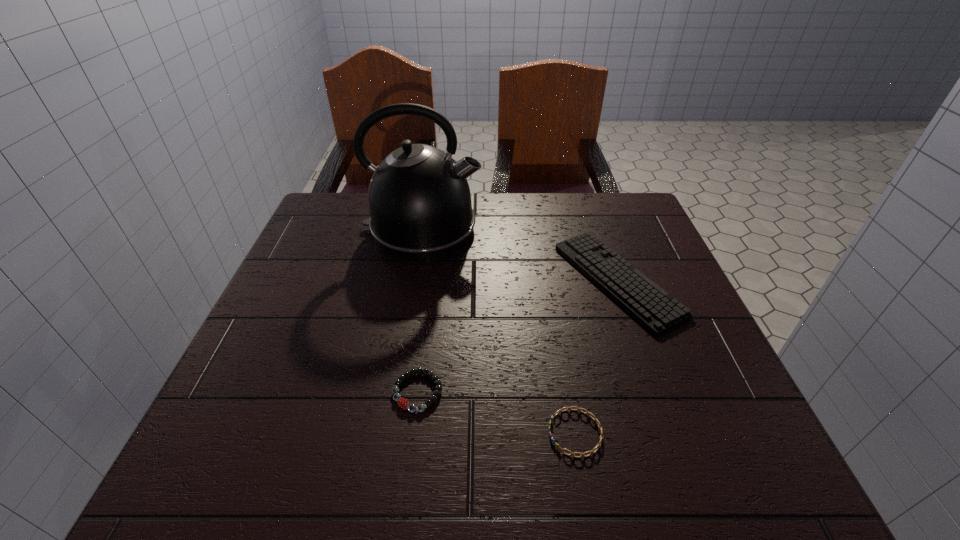
Locate an element on the screen. free space located 0.140m on the surface of the shorter bracelet showing star-shaped elements is located at coordinates (464, 433).

Where is `free point located 0.100m on the surface of the shorter bracelet showing star-shaped elements`? The width and height of the screenshot is (960, 540). free point located 0.100m on the surface of the shorter bracelet showing star-shaped elements is located at coordinates [x=488, y=433].

Locate an element on the screen. kettle at the far edge is located at coordinates (419, 199).

Image resolution: width=960 pixels, height=540 pixels. Identify the location of computer keyboard situated at the far edge. (654, 308).

The image size is (960, 540). Identify the location of object positioned at the near edge. (598, 446).

This screenshot has width=960, height=540. Find the location of `object present at the left edge`. object present at the left edge is located at coordinates (419, 199).

Identify the location of object present at the right edge. (654, 308).

Where is `object at the far left corner`? Image resolution: width=960 pixels, height=540 pixels. object at the far left corner is located at coordinates (419, 199).

At what (x,y) coordinates should I click in order to perform the action: click on object that is at the far right corner. Please return your answer as a coordinate pair (x, y). The image size is (960, 540). Looking at the image, I should click on (654, 308).

In the image, there is a desktop. At what (x,y) coordinates should I click in order to perform the action: click on vacant space at the far edge. Please return your answer as a coordinate pair (x, y). Image resolution: width=960 pixels, height=540 pixels. Looking at the image, I should click on (583, 218).